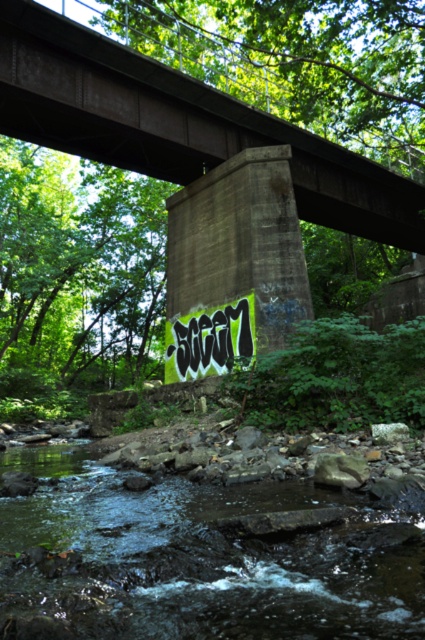
You are a hiker trying to cross the bridge and need to step on the green mossy rock at lower center and the concrete at center. Which surface should you step on first if you want to reach the higher elevation?

The concrete at center is taller than the green mossy rock at lower center, so you should step on the concrete at center first to reach higher elevation.

You are a hiker who wants to cross the stream safely. You notice the green mossy rock at lower center and the concrete at center. Which object is positioned to the right side of the other?

The green mossy rock at lower center is to the right of concrete at center, so the green mossy rock at lower center is positioned to the right side of the concrete at center.